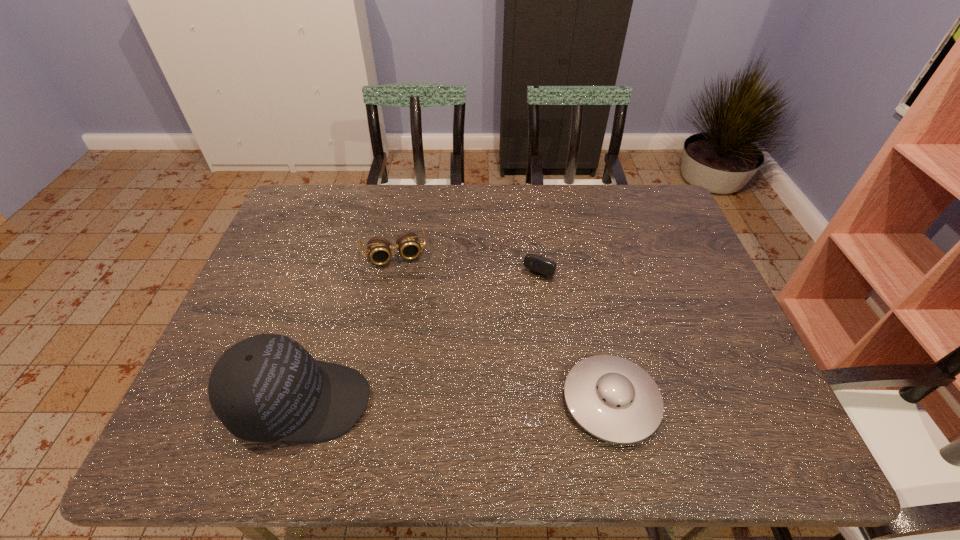
The height and width of the screenshot is (540, 960). I want to click on free space between the webcam and the saucer, so click(x=581, y=326).

Image resolution: width=960 pixels, height=540 pixels. What are the coordinates of `free spot between the webcam and the saucer` in the screenshot? It's located at (581, 326).

I want to click on vacant point located between the baseball cap and the webcam, so click(x=425, y=326).

Locate which object is the third closest to the goggles. Please provide its 2D coordinates. Your answer should be formatted as a tuple, i.e. [(x, y)], where the tuple contains the x and y coordinates of a point satisfying the conditions above.

[(615, 400)]

The width and height of the screenshot is (960, 540). I want to click on the closest object to the goggles, so click(539, 264).

Locate an element on the screen. blank space that satisfies the following two spatial constraints: 1. on the back side of the goggles; 2. on the right side of the webcam is located at coordinates (394, 250).